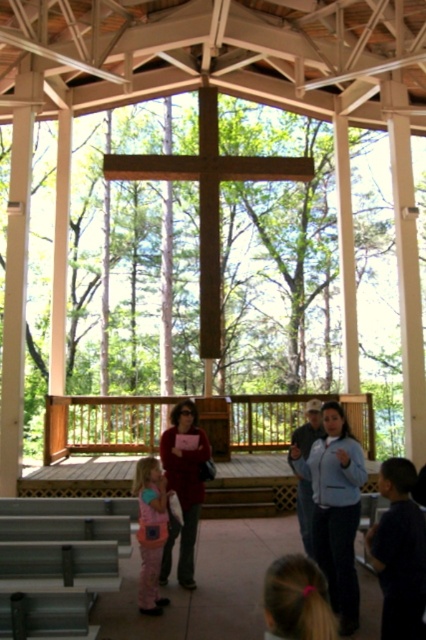
Identify the location of dark blue shirt at lower right. This screenshot has width=426, height=640. (399, 552).

Can you confirm if dark blue shirt at lower right is smaller than light blue shirt at center?

Actually, dark blue shirt at lower right might be larger than light blue shirt at center.

You are a GUI agent. You are given a task and a screenshot of the screen. Output one action in this format:
    pyautogui.click(x=<x>, y=<y>)
    Task: Click on the dark blue shirt at lower right
    This screenshot has width=426, height=640.
    Given the screenshot: What is the action you would take?
    pyautogui.click(x=399, y=552)

At what (x,y) coordinates should I click in order to perform the action: click on dark blue shirt at lower right. Please return your answer as a coordinate pair (x, y). The height and width of the screenshot is (640, 426). Looking at the image, I should click on [399, 552].

Does wooden deck at center have a smaller size compared to matte red sweater at center?

Correct, wooden deck at center occupies less space than matte red sweater at center.

Is wooden deck at center taller than matte red sweater at center?

No.

The image size is (426, 640). What are the coordinates of `wooden deck at center` in the screenshot? It's located at (94, 440).

In the scene shown: Is wooden deck at center smaller than pink fleece jacket at lower left?

Answer: Indeed, wooden deck at center has a smaller size compared to pink fleece jacket at lower left.

Which is more to the right, wooden deck at center or pink fleece jacket at lower left?

wooden deck at center is more to the right.

This screenshot has width=426, height=640. Describe the element at coordinates (94, 440) in the screenshot. I see `wooden deck at center` at that location.

This screenshot has height=640, width=426. In order to click on wooden deck at center in this screenshot , I will do `click(94, 440)`.